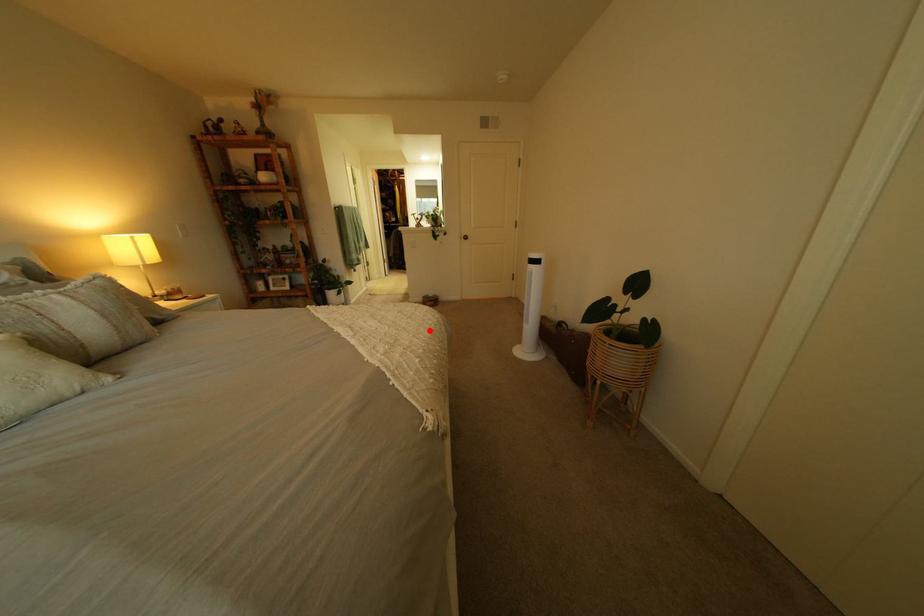
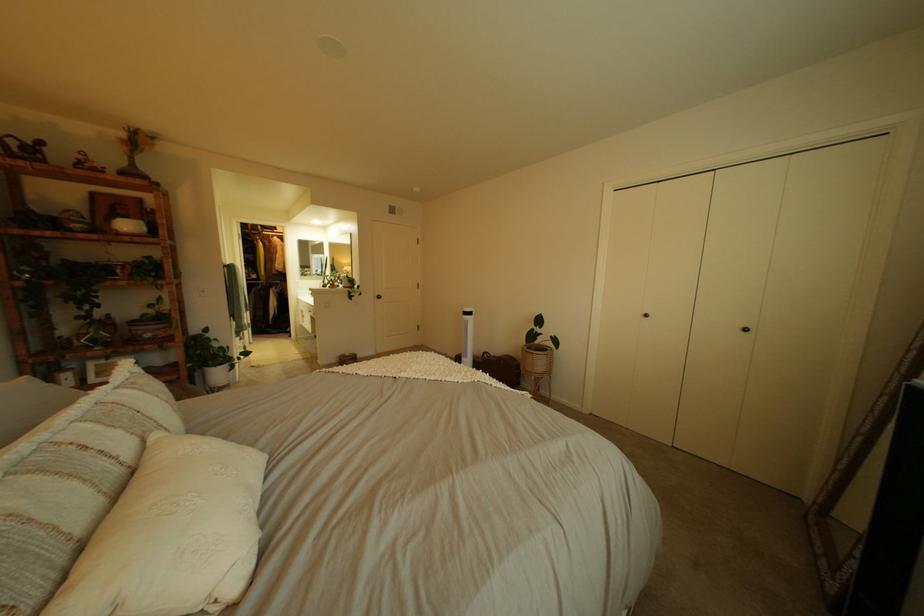
Question: I am providing you with two images of the same scene from different viewpoints. Given a red point in image1, look at the same physical point in image2. Is it:

Choices:
 (A) Closer to the viewpoint
 (B) Farther from the viewpoint

Answer: (A)